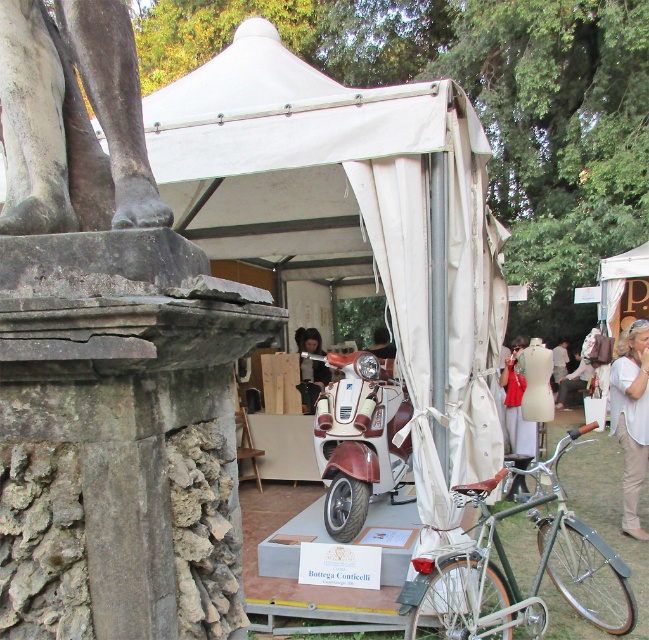
You are setting up a temporary exhibit and need to ensure the white canvas tent at center can accommodate the matte white scooter at center. Based on the scene description, will the tent fit the scooter?

The white canvas tent at center has a smaller size compared to matte white scooter at center, so the tent cannot accommodate the scooter as it is not large enough.